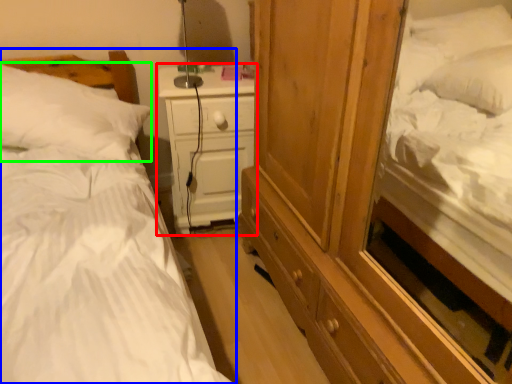
Question: Based on their relative distances, which object is farther from nightstand (highlighted by a red box)? Choose from bed (highlighted by a blue box) and pillow (highlighted by a green box).

Choices:
 (A) bed
 (B) pillow

Answer: (A)